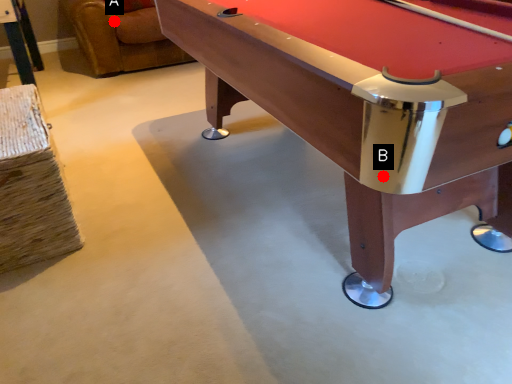
Question: Two points are circled on the image, labeled by A and B beside each circle. Which point is closer to the camera taking this photo?

Choices:
 (A) A is closer
 (B) B is closer

Answer: (B)